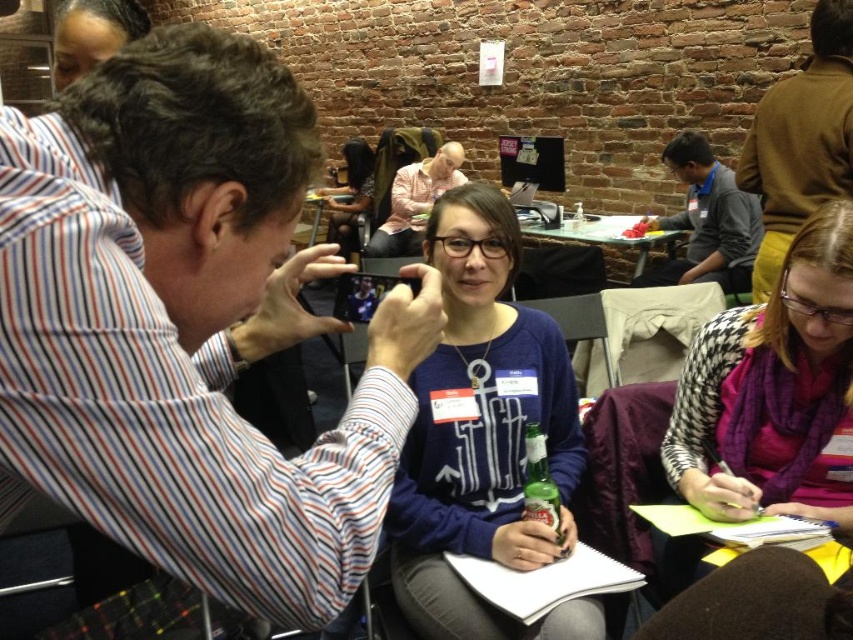
You are a photographer in the workshop and you need to adjust the lighting between the striped cotton shirt at center and the light pink shirt at center. Which shirt should you move to the right to balance the light?

The striped cotton shirt at center is to the left of the light pink shirt at center. To balance the light, move the striped cotton shirt at center to the right so it aligns better with the light pink shirt at center.

You are a photographer in the workshop. You want to ensure that the purple scarf at lower right is visible in your photo without being blocked by the matte black shirt at center. Based on their positions, is this possible?

The purple scarf at lower right is in front of the matte black shirt at center, so it will block the view of the matte black shirt at center. To make the purple scarf visible without obstruction, you might need to adjust the angle or position of the shirt or scarf.